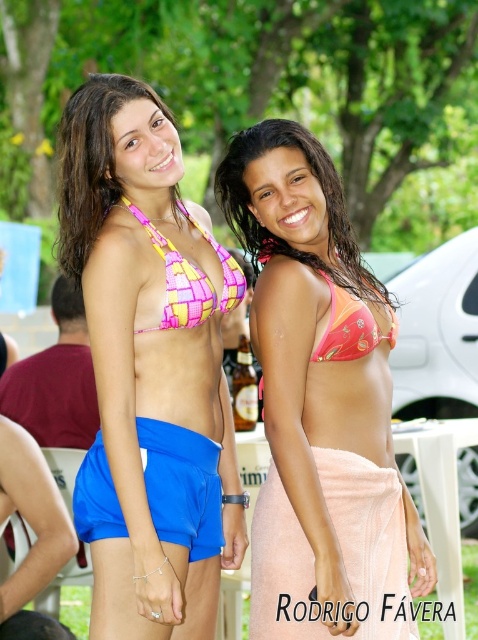
Can you confirm if pink woven bikini top at center is smaller than pink checkered bikini top at upper center?

No, pink woven bikini top at center is not smaller than pink checkered bikini top at upper center.

Is point (189, 576) positioned before point (131, 212)?

Yes, point (189, 576) is in front of point (131, 212).

Locate an element on the screen. This screenshot has width=478, height=640. pink woven bikini top at center is located at coordinates (150, 362).

Locate an element on the screen. pink fabric bikini at center is located at coordinates (314, 381).

Which is behind, point (358, 349) or point (91, 484)?

Point (358, 349)

The image size is (478, 640). In order to click on pink fabric bikini at center in this screenshot , I will do `click(314, 381)`.

Consider the image. Can you confirm if pink woven bikini top at center is wider than peach terry towel at lower right?

Yes, pink woven bikini top at center is wider than peach terry towel at lower right.

Does pink woven bikini top at center have a smaller size compared to peach terry towel at lower right?

Actually, pink woven bikini top at center might be larger than peach terry towel at lower right.

Locate an element on the screen. pink woven bikini top at center is located at coordinates (150, 362).